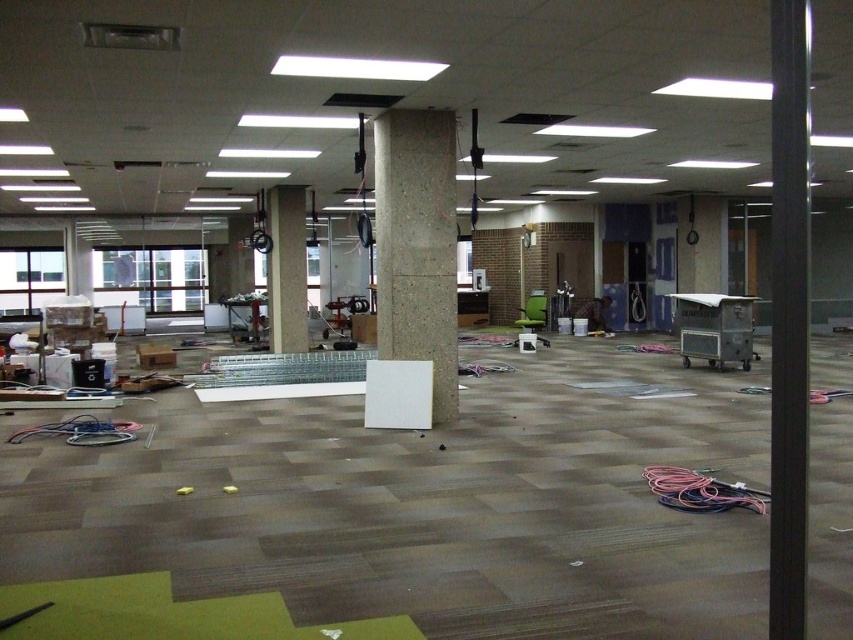
You are a construction worker standing in the room and need to move the black smooth pole at right and the concrete at center to a storage area. Which object should you move first if you want to move the one closer to you first?

You should move the black smooth pole at right first because it is closer to you than the concrete at center.